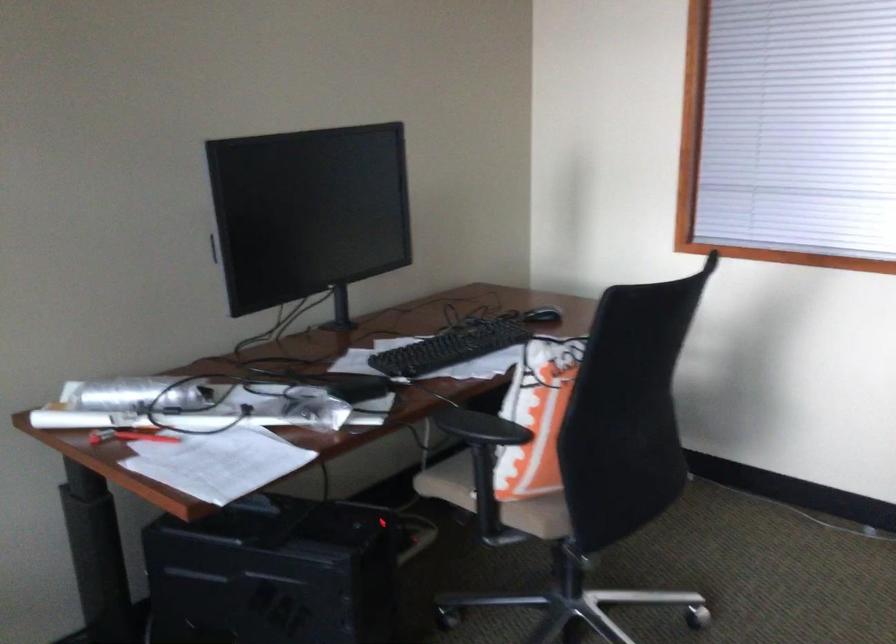
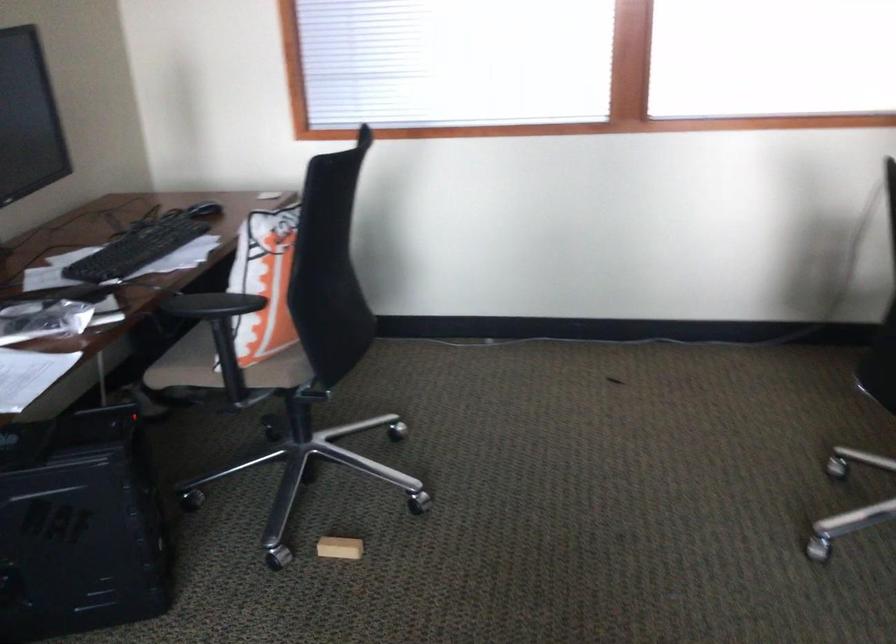
Find the pixel in the second image that matches point (481, 502) in the first image.

(228, 370)